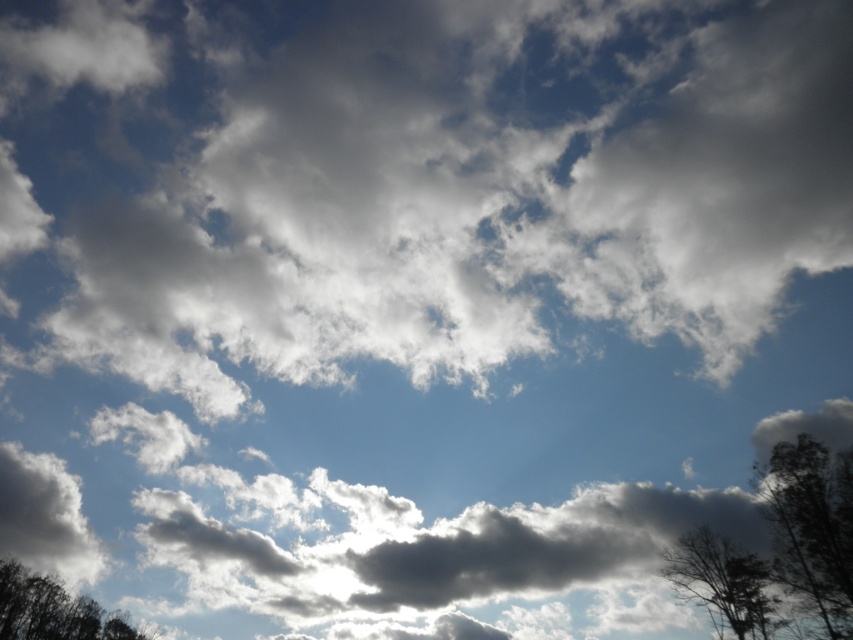
Question: Which point is farther to the camera?

Choices:
 (A) (781, 518)
 (B) (97, 609)

Answer: (B)

Question: Which point is farther from the camera taking this photo?

Choices:
 (A) pyautogui.click(x=15, y=577)
 (B) pyautogui.click(x=799, y=572)

Answer: (A)

Question: Is dark brown textured tree at lower right to the right of dark green leafy tree at lower left from the viewer's perspective?

Choices:
 (A) yes
 (B) no

Answer: (A)

Question: Which point is farther from the camera taking this photo?

Choices:
 (A) (817, 595)
 (B) (726, 588)
 (C) (90, 596)

Answer: (C)

Question: Is dark green leafy tree at lower right wider than dark brown textured tree at lower right?

Choices:
 (A) no
 (B) yes

Answer: (B)

Question: Can you confirm if dark green leafy tree at lower right is bigger than dark brown textured tree at lower right?

Choices:
 (A) yes
 (B) no

Answer: (A)